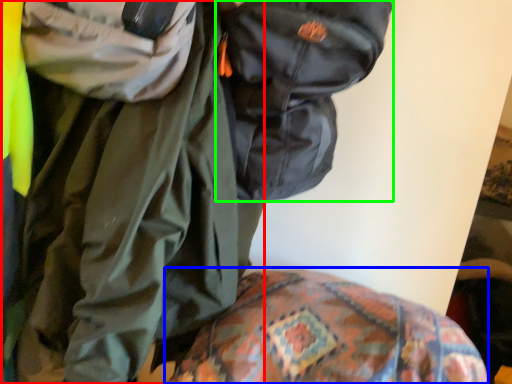
Question: Which object is the farthest from jacket (highlighted by a red box)? Choose among these: bedding (highlighted by a blue box) or backpack (highlighted by a green box).

Choices:
 (A) bedding
 (B) backpack

Answer: (A)